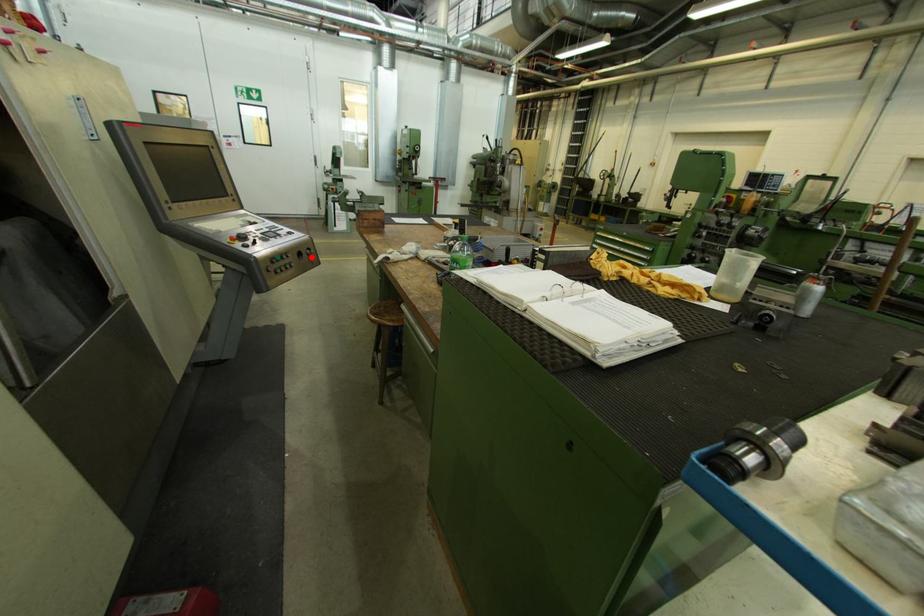
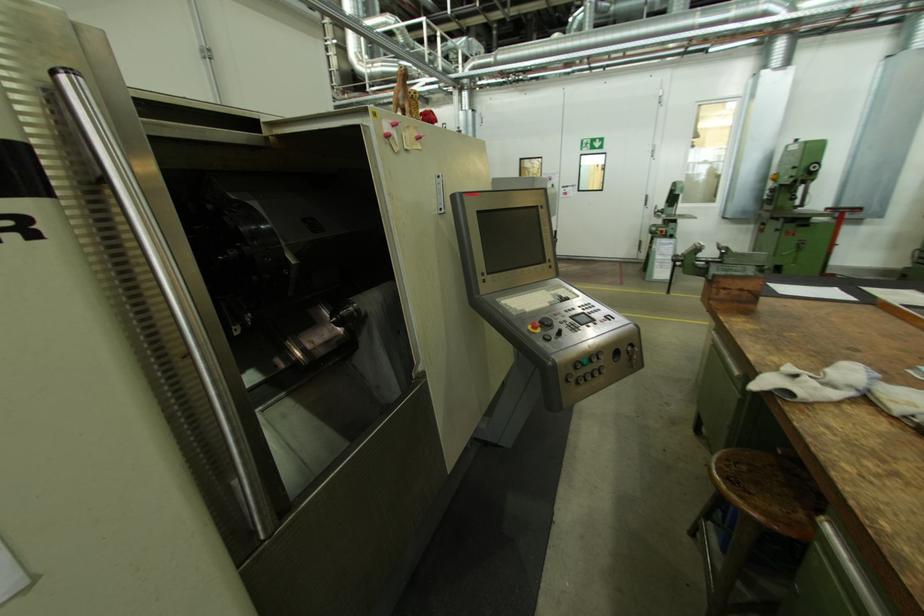
Find the pixel in the second image that matches the highlighted location in the first image.

(629, 357)